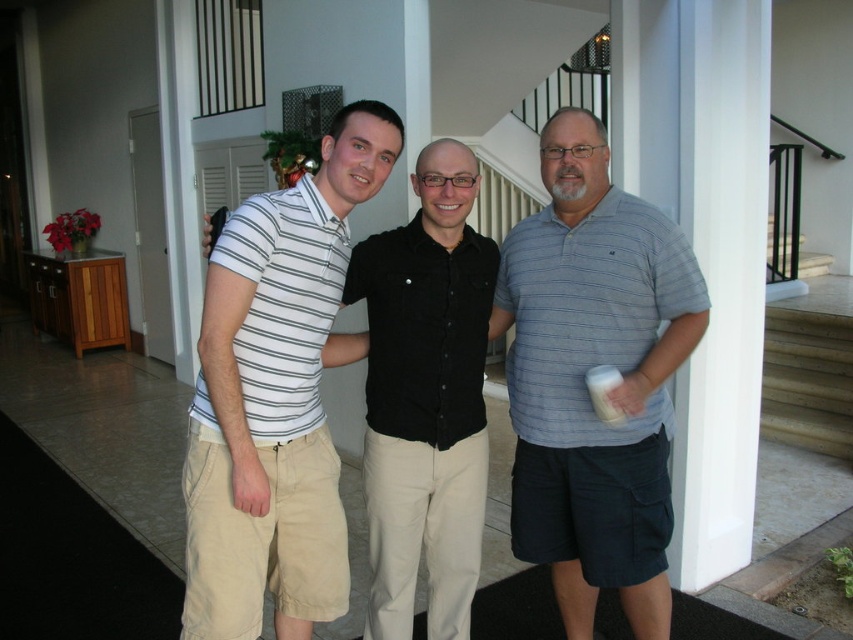
Consider the image. You are standing at the origin of the coordinate system in the image. The point at coordinate (584, 380) is marked. Which person is located at this point?

The point at coordinate (584, 380) marks the blue striped polo shirt at center, so the person in the center is located at this point.

You are a fashion designer observing the three people in the image. You need to determine the vertical arrangement of the blue striped polo shirt at center and the white striped polo shirt at center. Which one is positioned lower?

The blue striped polo shirt at center is below the white striped polo shirt at center, so the blue striped polo shirt at center is positioned lower.

You are trying to find the black cotton shirt at center. Which direction should you look relative to the white striped polo shirt at center?

The black cotton shirt at center is to the right of the white striped polo shirt at center.